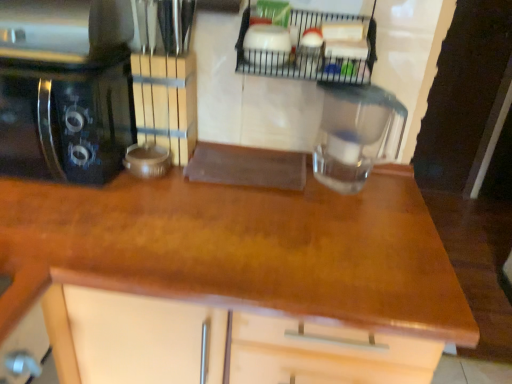
Locate an element on the screen. The width and height of the screenshot is (512, 384). free point above wooden at center (from a real-world perspective) is located at coordinates (203, 216).